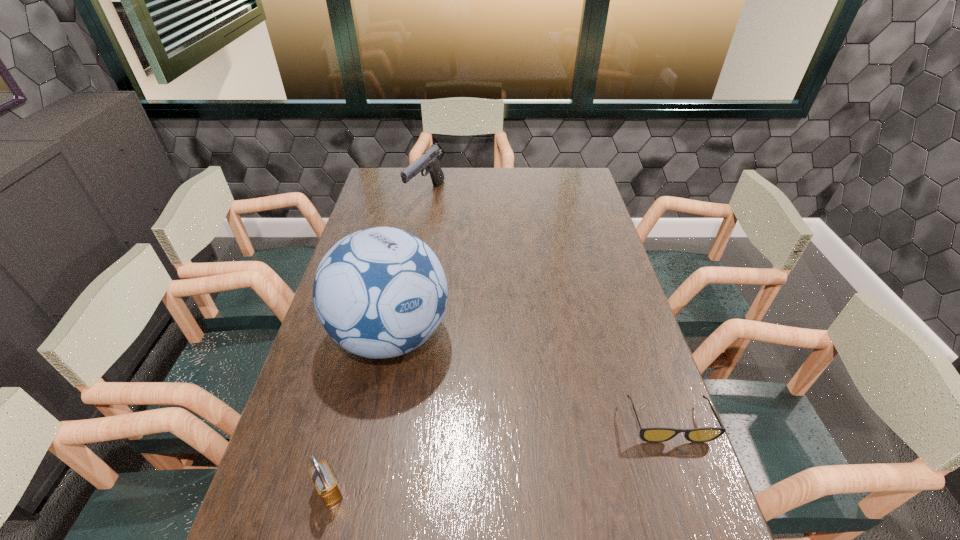
The height and width of the screenshot is (540, 960). I want to click on vacant space on the desktop that is between the second shortest object and the sunglasses and is positioned at the muzzle of the gun, so click(483, 460).

Locate an element on the screen. The height and width of the screenshot is (540, 960). vacant space on the desktop that is between the padlock and the rightmost object and is positioned on the side with brand of the soccer ball is located at coordinates (546, 447).